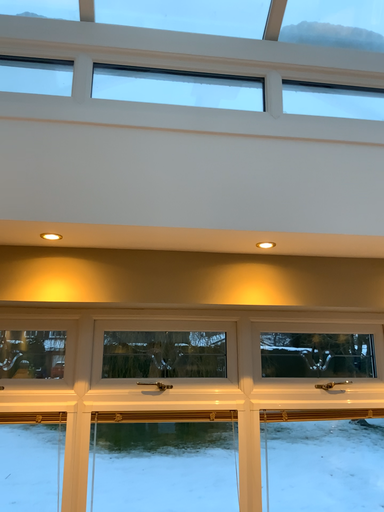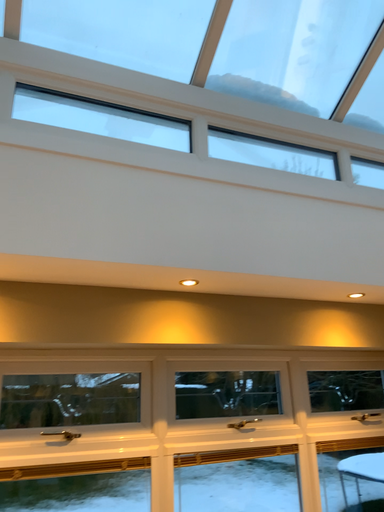
Question: Which way did the camera rotate in the video?

Choices:
 (A) rotated right
 (B) rotated left

Answer: (A)